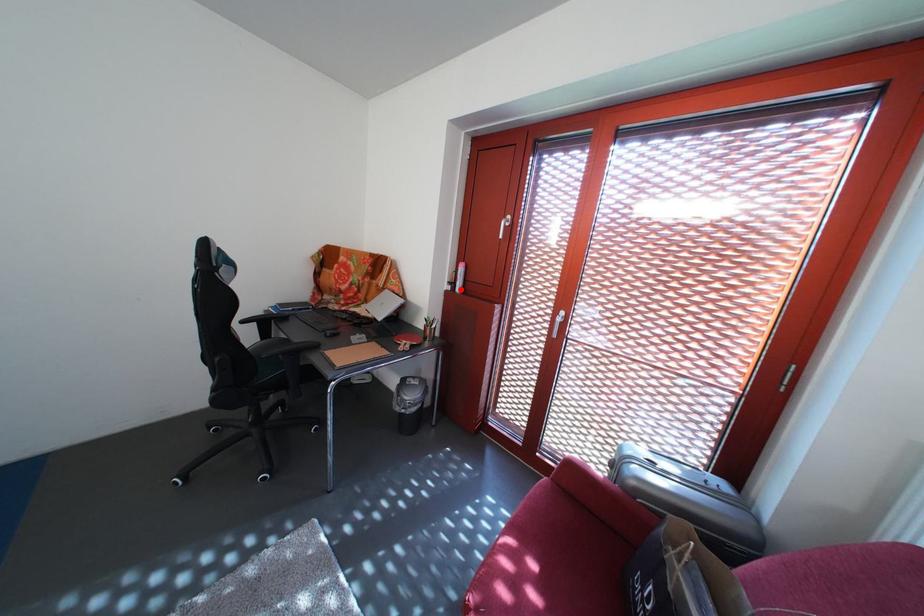
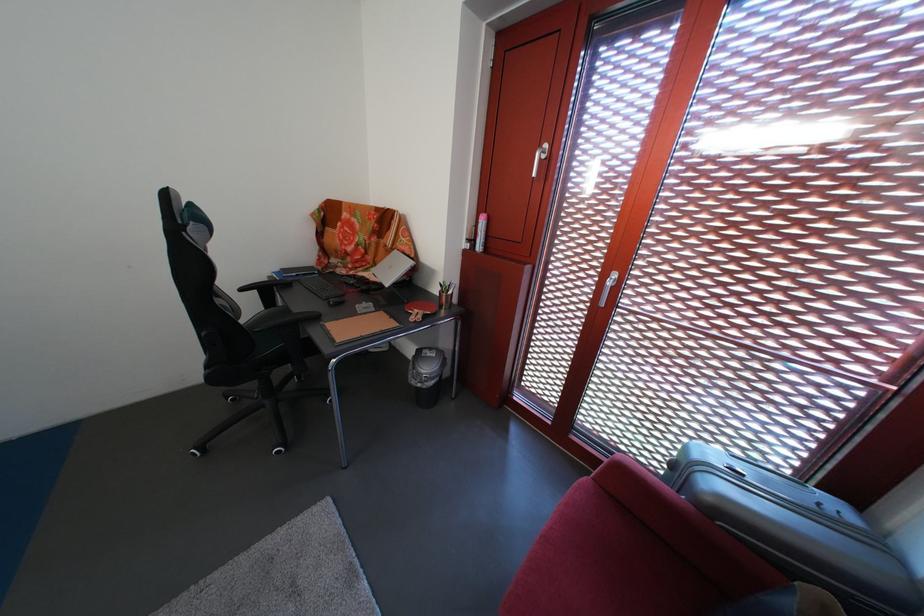
Locate, in the second image, the point that corresponds to the highlighted location in the first image.

(479, 246)